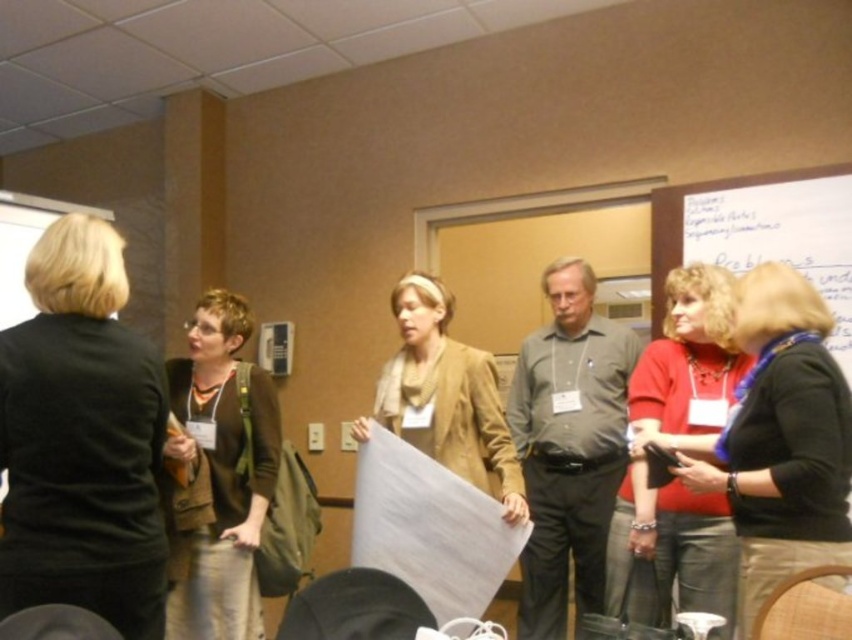
Who is shorter, matte black shirt at center or brown fabric vest at center-left?

matte black shirt at center

Is point (755, 365) more distant than point (229, 353)?

No, (755, 365) is in front of (229, 353).

Locate an element on the screen. The height and width of the screenshot is (640, 852). matte black shirt at center is located at coordinates (781, 438).

Where is `matte black shirt at center`? This screenshot has height=640, width=852. matte black shirt at center is located at coordinates (781, 438).

Between gray matte shirt at center and suede tan jacket at center, which one is positioned higher?

suede tan jacket at center

Who is more distant from viewer, (580,268) or (413,339)?

The point (580,268) is behind.

Is point (573, 353) more distant than point (373, 419)?

Yes, it is behind point (373, 419).

Identify the location of gray matte shirt at center. (568, 445).

What do you see at coordinates (81, 440) in the screenshot?
I see `black fabric jacket at left` at bounding box center [81, 440].

Between black fabric jacket at left and brown fabric vest at center-left, which one appears on the right side from the viewer's perspective?

brown fabric vest at center-left is more to the right.

Which is behind, point (56, 227) or point (214, 529)?

Point (214, 529)

Image resolution: width=852 pixels, height=640 pixels. In order to click on black fabric jacket at left in this screenshot , I will do `click(81, 440)`.